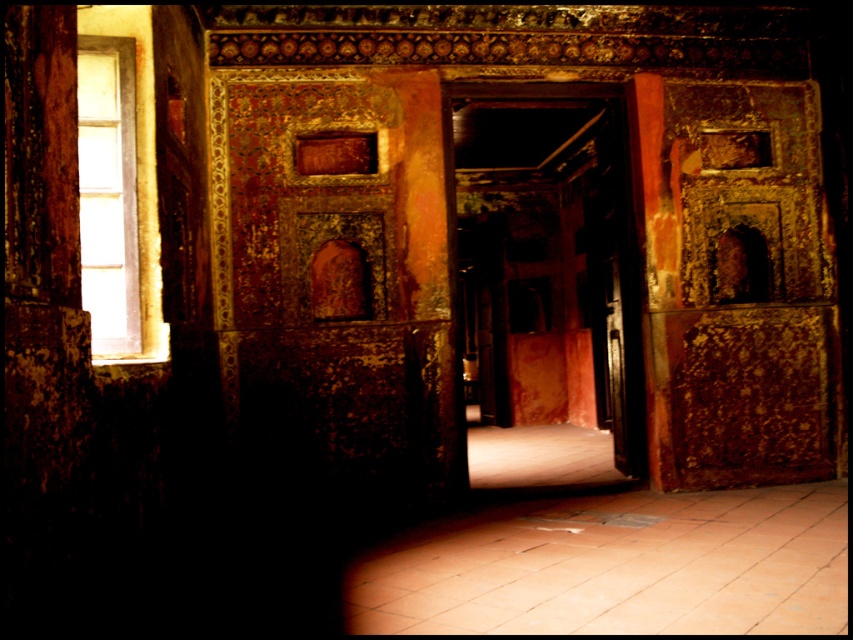
Does clear glass window at left have a greater width compared to metallic polished door at center?

Indeed, clear glass window at left has a greater width compared to metallic polished door at center.

Who is positioned more to the left, clear glass window at left or metallic polished door at center?

From the viewer's perspective, clear glass window at left appears more on the left side.

Is point (138, 88) farther from viewer compared to point (606, 300)?

No, it is in front of (606, 300).

You are a GUI agent. You are given a task and a screenshot of the screen. Output one action in this format:
    pyautogui.click(x=<x>, y=<y>)
    Task: Click on the clear glass window at left
    
    Given the screenshot: What is the action you would take?
    pyautogui.click(x=117, y=196)